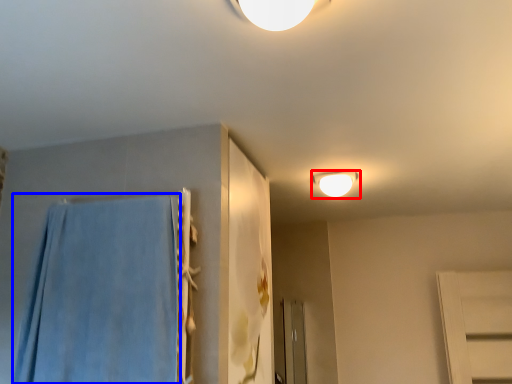
Question: Which point is further to the camera, lamp (highlighted by a red box) or bath towel (highlighted by a blue box)?

Choices:
 (A) lamp
 (B) bath towel

Answer: (A)